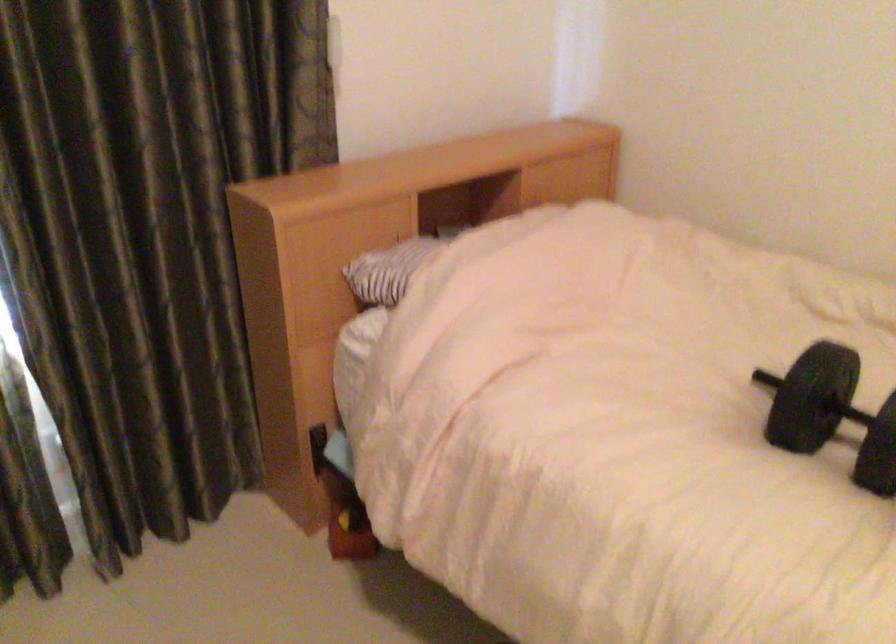
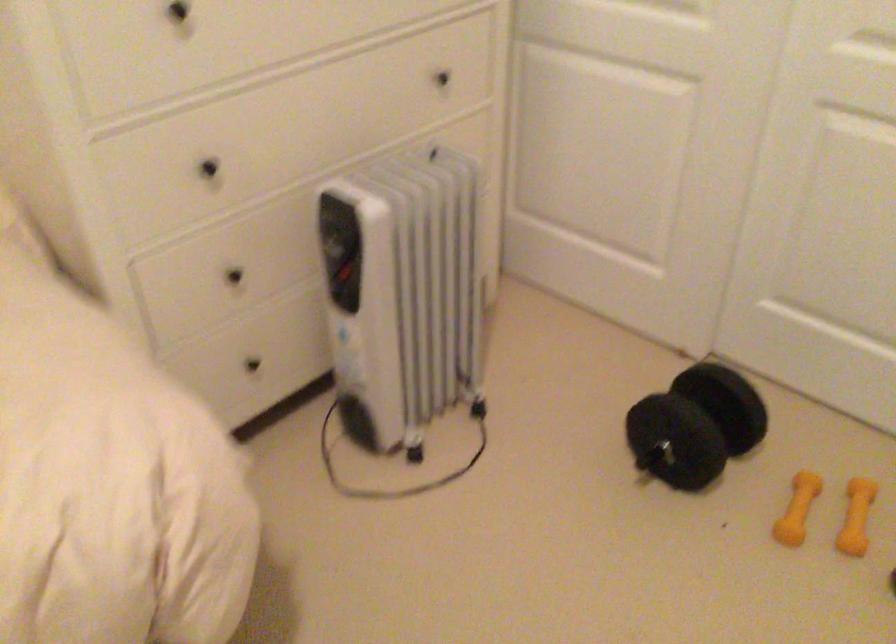
First-person continuous shooting, in which direction is the camera rotating?

The camera's rotation is toward right-down.